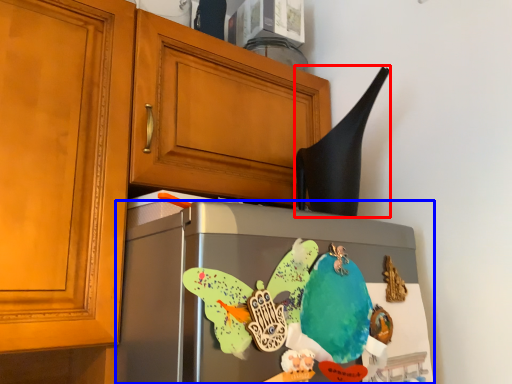
Question: Among these objects, which one is nearest to the camera, exhaust hood (highlighted by a red box) or refrigerator (highlighted by a blue box)?

Choices:
 (A) exhaust hood
 (B) refrigerator

Answer: (B)